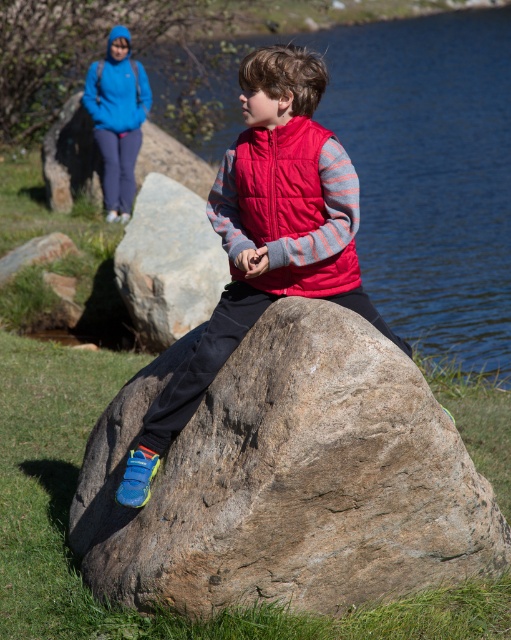
Question: Which point is closer to the camera taking this photo?

Choices:
 (A) (290, 157)
 (B) (245, 170)
 (C) (192, 236)

Answer: (A)

Question: Which point is farther to the camera?

Choices:
 (A) red puffy vest at center
 (B) blue fleece jacket at upper left
 (C) gray rough boulder at center

Answer: (B)

Question: Does brown rough boulder at center come behind blue fleece jacket at upper left?

Choices:
 (A) no
 (B) yes

Answer: (A)

Question: Where is brown rough boulder at center located in relation to blue fleece jacket at upper left in the image?

Choices:
 (A) above
 (B) below

Answer: (B)

Question: Considering the real-world distances, which object is closest to the matte red vest at center?

Choices:
 (A) blue fleece jacket at upper left
 (B) gray rough boulder at center
 (C) brown rough boulder at center

Answer: (C)

Question: Does brown rough boulder at center have a greater width compared to blue fleece jacket at upper left?

Choices:
 (A) no
 (B) yes

Answer: (B)